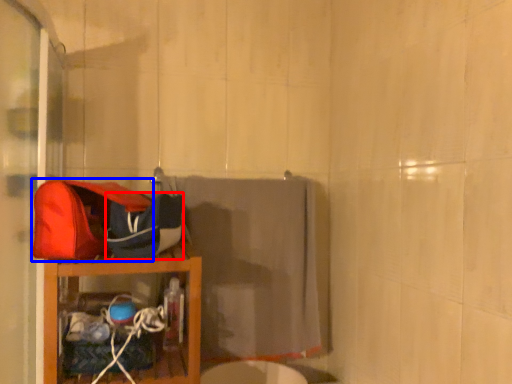
Question: Among these objects, which one is nearest to the camera, kit (highlighted by a red box) or shoulder bag (highlighted by a blue box)?

Choices:
 (A) kit
 (B) shoulder bag

Answer: (B)